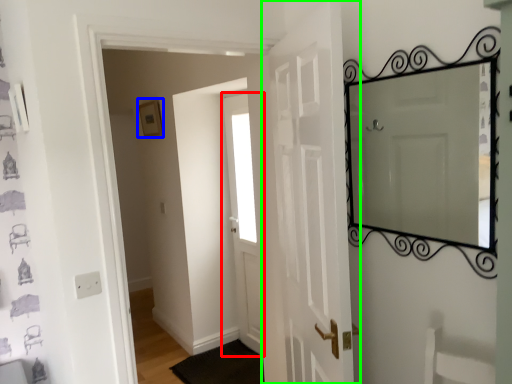
Question: Which is nearer to the door (highlighted by a red box)? picture frame (highlighted by a blue box) or door (highlighted by a green box).

Choices:
 (A) picture frame
 (B) door

Answer: (A)